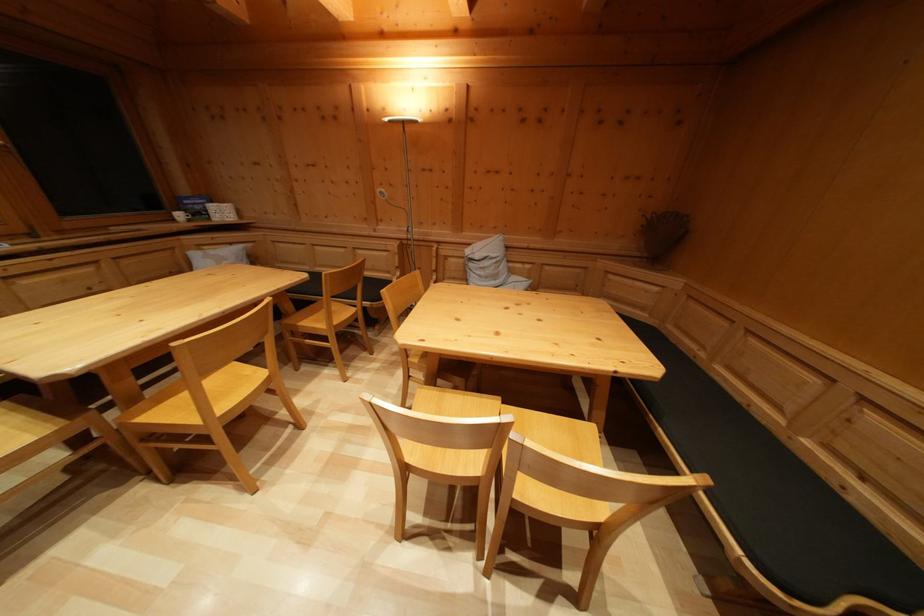
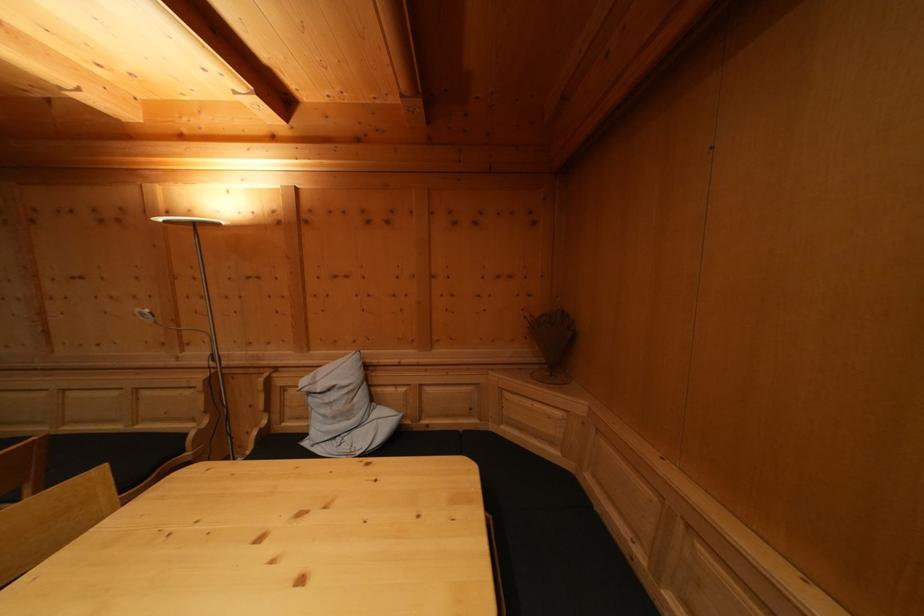
In a continuous first-person perspective shot, in which direction is the camera moving?

The movement direction of the cameraman is right, forward.